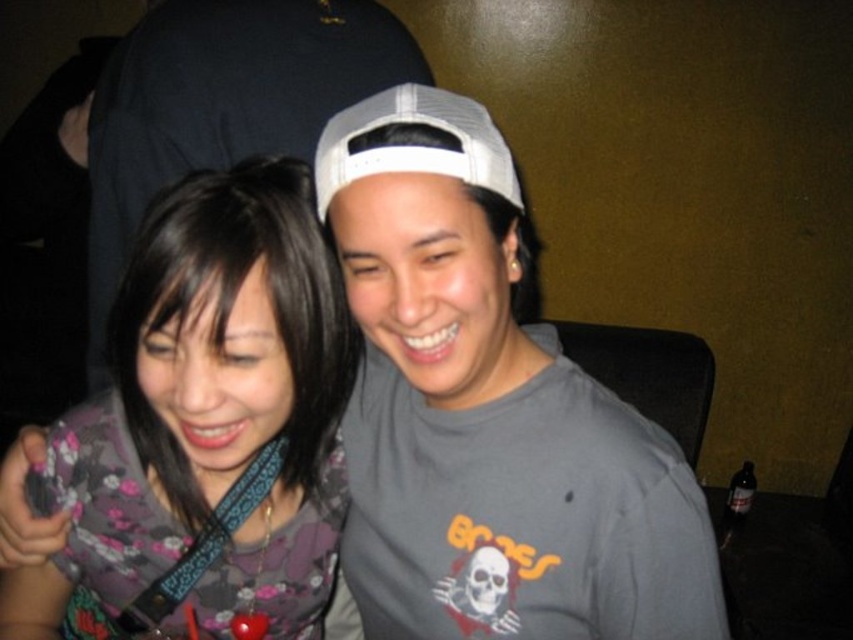
You are standing in a room where two people are present. You notice a point at coordinate [207,422]. Which object is located at that point?

The floral fabric shirt at center is located at point [207,422].